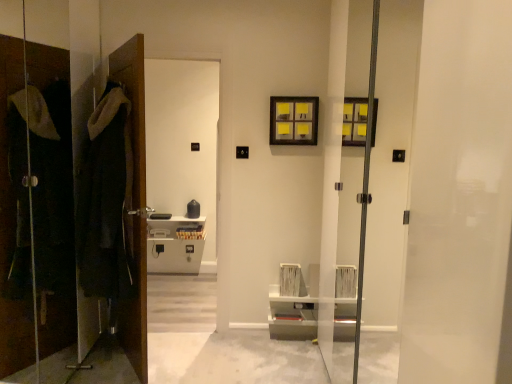
Question: Considering the relative sizes of brown wooden door at left and matte black coat at left in the image provided, is brown wooden door at left shorter than matte black coat at left?

Choices:
 (A) no
 (B) yes

Answer: (B)

Question: Does brown wooden door at left have a greater width compared to matte black coat at left?

Choices:
 (A) yes
 (B) no

Answer: (A)

Question: Considering the relative sizes of brown wooden door at left and matte black coat at left in the image provided, is brown wooden door at left smaller than matte black coat at left?

Choices:
 (A) yes
 (B) no

Answer: (A)

Question: Is matte black coat at left surrounded by brown wooden door at left?

Choices:
 (A) no
 (B) yes

Answer: (A)

Question: Is brown wooden door at left further to camera compared to matte black coat at left?

Choices:
 (A) no
 (B) yes

Answer: (B)

Question: Is brown wooden door at left in front of matte black coat at left?

Choices:
 (A) no
 (B) yes

Answer: (A)

Question: From a real-world perspective, is brown wooden door at left located beneath dark woolen robe at left?

Choices:
 (A) no
 (B) yes

Answer: (B)

Question: Does brown wooden door at left have a greater height compared to dark woolen robe at left?

Choices:
 (A) yes
 (B) no

Answer: (A)

Question: From a real-world perspective, is brown wooden door at left on dark woolen robe at left?

Choices:
 (A) no
 (B) yes

Answer: (A)

Question: From the image's perspective, would you say brown wooden door at left is shown under dark woolen robe at left?

Choices:
 (A) no
 (B) yes

Answer: (B)

Question: Is brown wooden door at left outside of dark woolen robe at left?

Choices:
 (A) no
 (B) yes

Answer: (B)

Question: Considering the relative positions of brown wooden door at left and dark woolen robe at left in the image provided, is brown wooden door at left to the left of dark woolen robe at left from the viewer's perspective?

Choices:
 (A) no
 (B) yes

Answer: (A)

Question: Could you tell me if wooden picture frame at upper center is facing dark woolen robe at left?

Choices:
 (A) yes
 (B) no

Answer: (B)